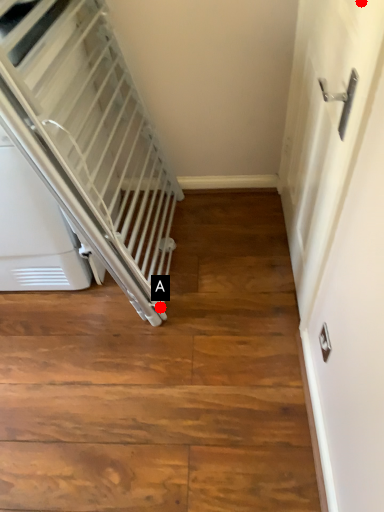
Question: Two points are circled on the image, labeled by A and B beside each circle. Which of the following is the farthest from the observer?

Choices:
 (A) A is further
 (B) B is further

Answer: (A)